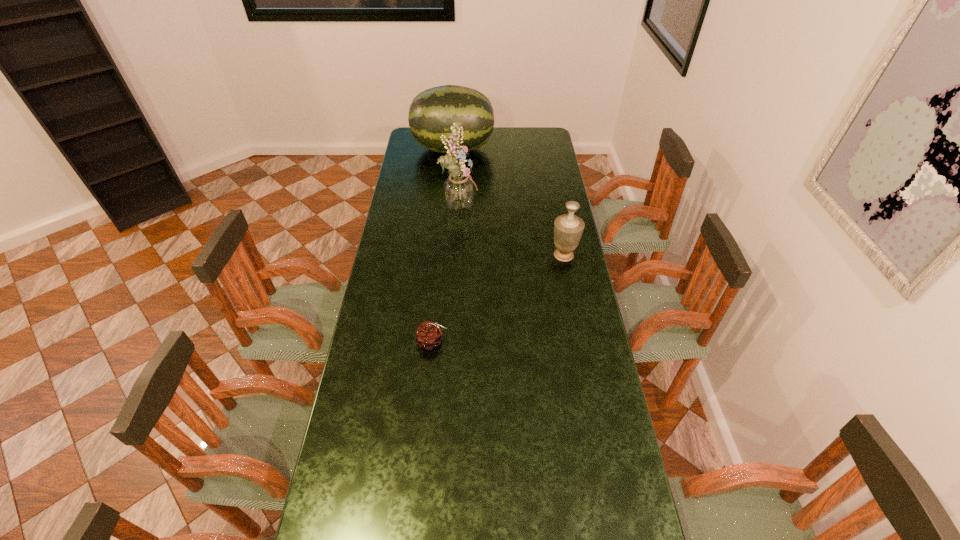
At what (x,y) coordinates should I click in order to perform the action: click on free space located on the left of the second nearest object. Please return your answer as a coordinate pair (x, y). The image size is (960, 540). Looking at the image, I should click on (464, 255).

Where is `vacant point located with a leaf charm attached to the nearest object`? The width and height of the screenshot is (960, 540). vacant point located with a leaf charm attached to the nearest object is located at coordinates (467, 342).

This screenshot has width=960, height=540. Find the location of `object that is at the far edge`. object that is at the far edge is located at coordinates (432, 112).

The width and height of the screenshot is (960, 540). Identify the location of object positioned at the left edge. (432, 112).

Locate an element on the screen. This screenshot has width=960, height=540. object at the right edge is located at coordinates (568, 228).

Image resolution: width=960 pixels, height=540 pixels. What are the coordinates of `object positioned at the far left corner` in the screenshot? It's located at (432, 112).

You are a GUI agent. You are given a task and a screenshot of the screen. Output one action in this format:
    pyautogui.click(x=<x>, y=<y>)
    Task: Click on the free region at the left edge of the desktop
    
    Given the screenshot: What is the action you would take?
    pyautogui.click(x=375, y=294)

Image resolution: width=960 pixels, height=540 pixels. In the image, there is a desktop. What are the coordinates of `free region at the right edge` in the screenshot? It's located at (547, 161).

This screenshot has height=540, width=960. I want to click on empty space between the shortest object and the third shortest object, so click(443, 246).

This screenshot has height=540, width=960. Find the location of `empty space that is in between the third tallest object and the tallest object`. empty space that is in between the third tallest object and the tallest object is located at coordinates (512, 231).